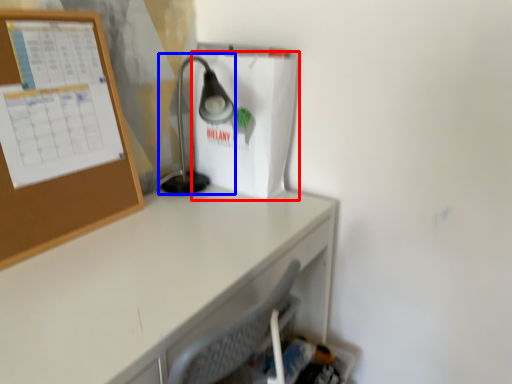
Question: Among these objects, which one is farthest to the camera, paper bag (highlighted by a red box) or lamp (highlighted by a blue box)?

Choices:
 (A) paper bag
 (B) lamp

Answer: (A)